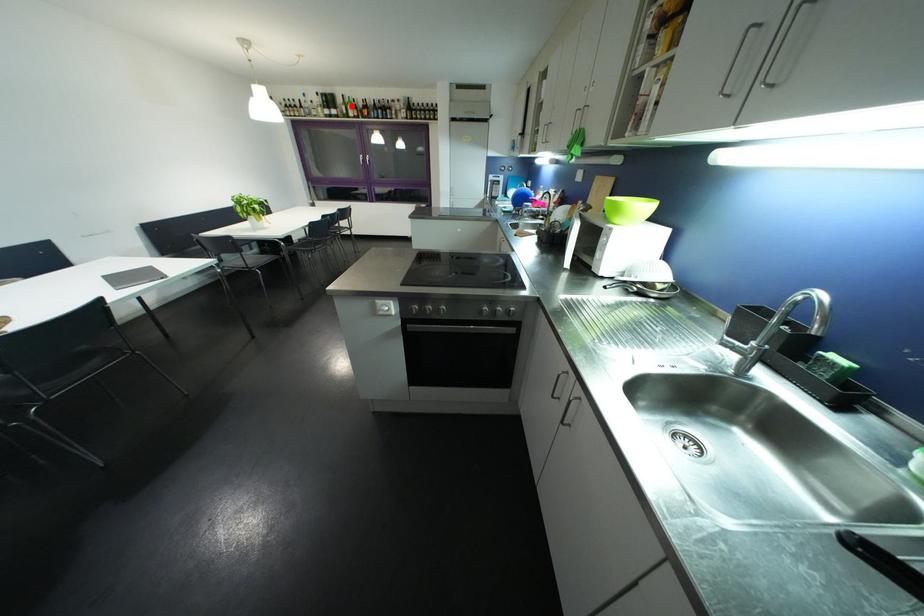
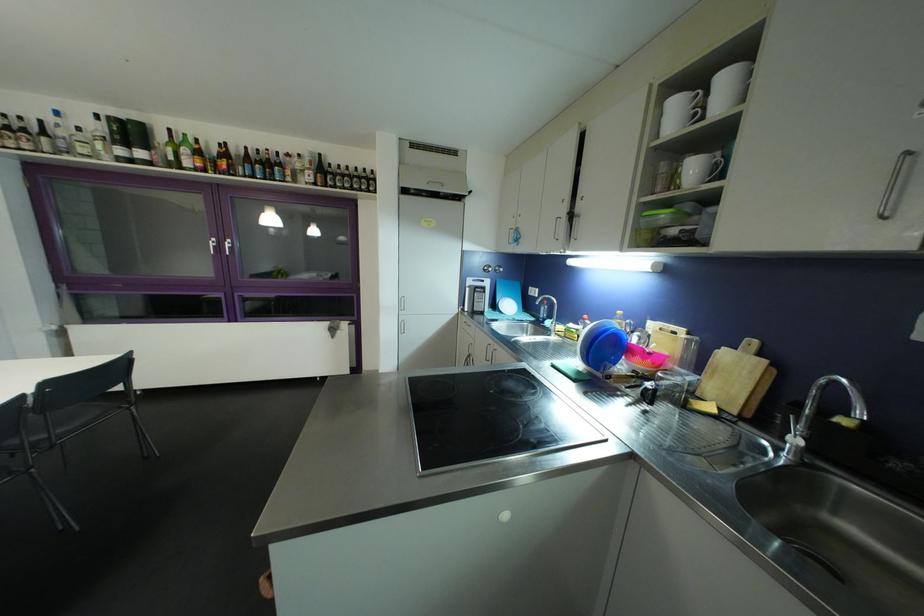
Where in the second image is the point corresponding to the highlighted location from the first image?

(180, 146)